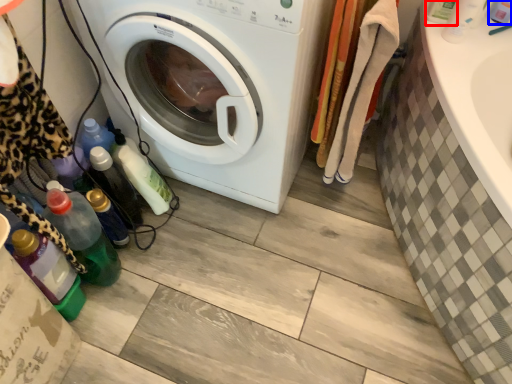
Question: Which point is further to the camera, bottle (highlighted by a red box) or toiletry (highlighted by a blue box)?

Choices:
 (A) bottle
 (B) toiletry

Answer: (A)